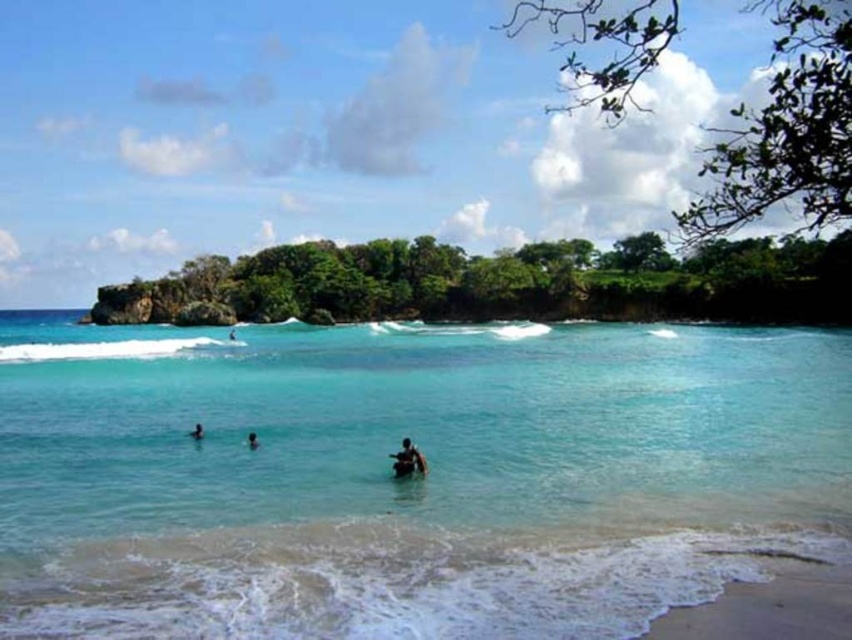
Question: Considering the relative positions of smooth skin person at center and dark brown skin at lower center in the image provided, where is smooth skin person at center located with respect to dark brown skin at lower center?

Choices:
 (A) left
 (B) right

Answer: (B)

Question: Is clear blue water at center thinner than dark blue skin at center?

Choices:
 (A) yes
 (B) no

Answer: (B)

Question: Where is clear blue water at center located in relation to dark brown skin at lower center in the image?

Choices:
 (A) above
 (B) below

Answer: (A)

Question: Which of the following is the closest to the observer?

Choices:
 (A) dark brown skin at lower center
 (B) clear blue water at center
 (C) dark blue skin at center
 (D) smooth skin person at center

Answer: (B)

Question: Which point is farther from the camera taking this photo?

Choices:
 (A) (209, 432)
 (B) (234, 333)

Answer: (B)

Question: Which point is farther to the camera?

Choices:
 (A) dark brown skin at lower center
 (B) smooth skin person at lower center
 (C) smooth skin person at center
 (D) clear blue water at center

Answer: (A)